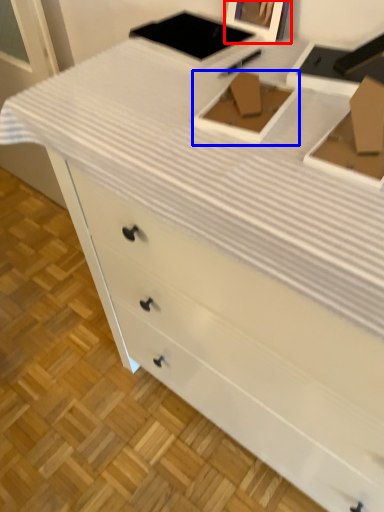
Question: Which object appears farthest to the camera in this image, picture frame (highlighted by a red box) or box (highlighted by a blue box)?

Choices:
 (A) picture frame
 (B) box

Answer: (A)